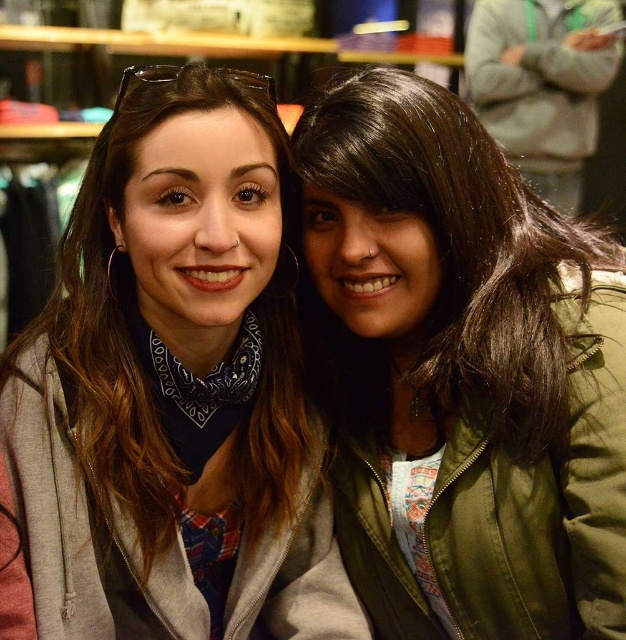
You are standing in the image and want to grab the gray fleece jacket at center. Based on its 2D position coordinates, where should you look to find it?

The gray fleece jacket at center is located at the 2D coordinates point (172, 392), so you should look there to find it.

You are taking a photo of two people standing in front of a clothing store. You want to place a sticker on the photo such that it appears closer to the camera. Which point should you choose between point (x=590, y=257) and point (x=560, y=88)?

Point (x=590, y=257) is closer to the camera than point (x=560, y=88), so you should choose point (x=590, y=257) to place the sticker so it appears closer to the camera.